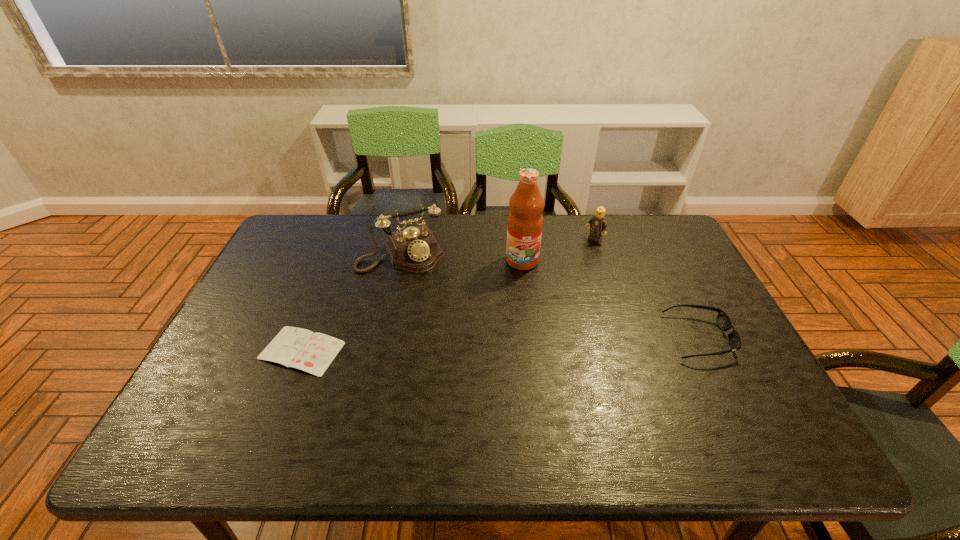
Where is `vacant space located on the front label of the third object from left to right`? vacant space located on the front label of the third object from left to right is located at coordinates (523, 360).

Where is `vacant space positioned on the front label of the third object from left to right`? Image resolution: width=960 pixels, height=540 pixels. vacant space positioned on the front label of the third object from left to right is located at coordinates (523, 377).

The width and height of the screenshot is (960, 540). What are the coordinates of `free spot located on the dial of the telephone` in the screenshot? It's located at click(x=436, y=316).

The height and width of the screenshot is (540, 960). Find the location of `free region located on the dial of the telephone`. free region located on the dial of the telephone is located at coordinates (435, 313).

Find the location of a particular element. The image size is (960, 540). blank area located on the dial of the telephone is located at coordinates (459, 364).

I want to click on free space located 0.140m in front of the third tallest object, so click(565, 264).

At what (x,y) coordinates should I click in order to perform the action: click on free space located in front of the third tallest object. Please return your answer as a coordinate pair (x, y). Image resolution: width=960 pixels, height=540 pixels. Looking at the image, I should click on (525, 296).

Where is `vacant space located in front of the third tallest object`? vacant space located in front of the third tallest object is located at coordinates (556, 271).

I want to click on fruit juice that is at the far edge, so click(x=525, y=222).

Image resolution: width=960 pixels, height=540 pixels. I want to click on telephone located at the far edge, so click(x=414, y=249).